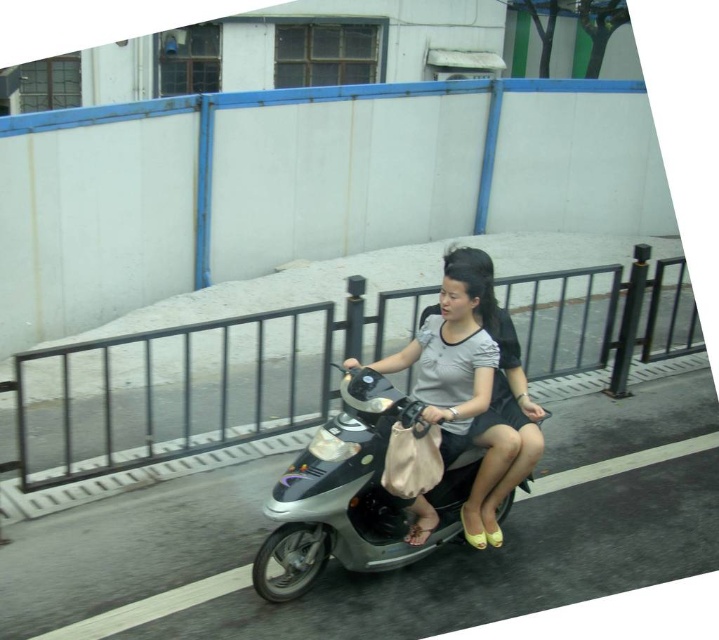
Question: Is light gray matte shirt at center below matte gray shirt at center?

Choices:
 (A) yes
 (B) no

Answer: (B)

Question: Which point is farther from the camera taking this photo?

Choices:
 (A) (111, 448)
 (B) (390, 556)
 (C) (485, 321)

Answer: (A)

Question: Does black metal rail at center have a lesser width compared to light gray matte shirt at center?

Choices:
 (A) yes
 (B) no

Answer: (B)

Question: Does black metal rail at center come behind metallic silver scooter at center?

Choices:
 (A) no
 (B) yes

Answer: (B)

Question: Among these objects, which one is farthest from the camera?

Choices:
 (A) matte gray shirt at center
 (B) metallic silver scooter at center
 (C) black metal rail at center
 (D) light gray matte shirt at center

Answer: (C)

Question: Estimate the real-world distances between objects in this image. Which object is farther from the light gray matte shirt at center?

Choices:
 (A) black metal rail at center
 (B) metallic silver scooter at center
 (C) matte gray shirt at center

Answer: (A)